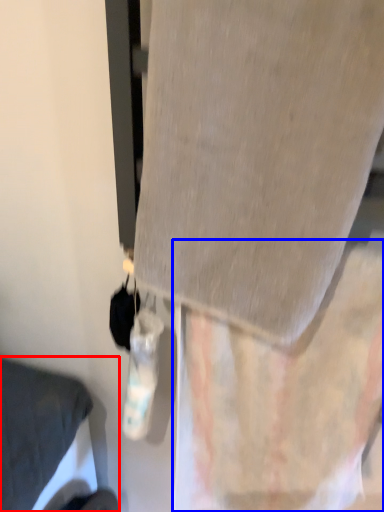
Question: Among these objects, which one is nearest to the camera, furniture (highlighted by a red box) or curtain (highlighted by a blue box)?

Choices:
 (A) furniture
 (B) curtain

Answer: (B)